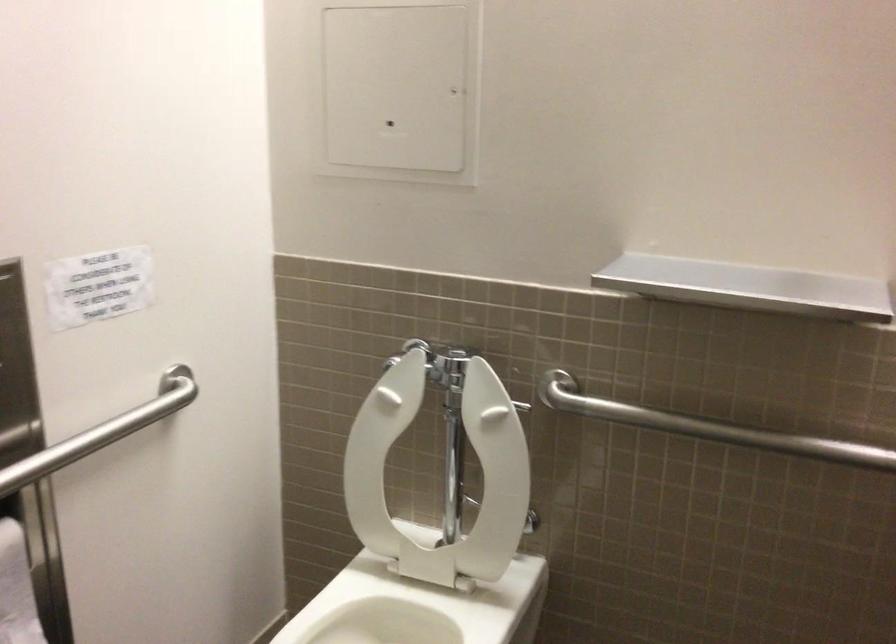
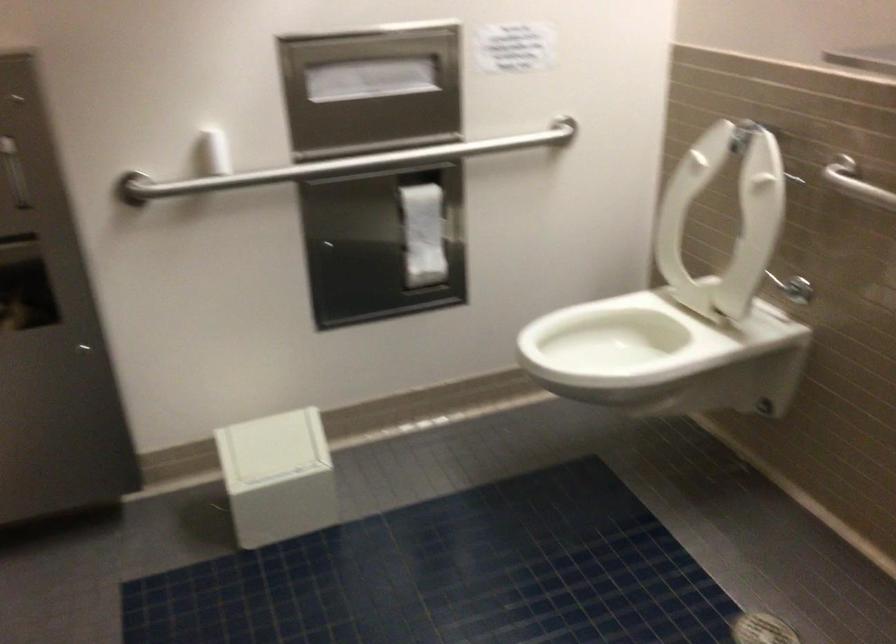
Question: Based on the continuous images, in which direction is the camera rotating? Reply with the corresponding letter.

Choices:
 (A) Left
 (B) Right
 (C) Up
 (D) Down

Answer: (A)